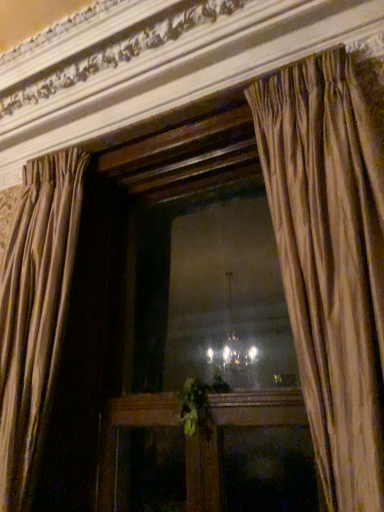
What do you see at coordinates (195, 406) in the screenshot? I see `green leafy plant at center` at bounding box center [195, 406].

What is the approximate height of silky beige curtain at center, which is the 2th curtain in left-to-right order?

silky beige curtain at center, which is the 2th curtain in left-to-right order, is 5.67 feet in height.

What do you see at coordinates (35, 314) in the screenshot?
I see `silky beige curtain at left, the second curtain from the right` at bounding box center [35, 314].

The image size is (384, 512). Find the location of `green leafy plant at center`. green leafy plant at center is located at coordinates (195, 406).

You are a GUI agent. You are given a task and a screenshot of the screen. Output one action in this format:
    pyautogui.click(x=<x>, y=<y>)
    Task: Click on the curtain above the silky beige curtain at left, the first curtain viewed from the left (from a real-world perspective)
    This screenshot has width=384, height=512.
    Given the screenshot: What is the action you would take?
    pyautogui.click(x=330, y=261)

Looking at this image, does silky beige curtain at center, which is the 2th curtain in left-to-right order, have a larger size compared to silky beige curtain at left, the first curtain viewed from the left?

No.

Does point (331, 424) come behind point (26, 322)?

No, (331, 424) is closer to viewer.

Are silky beige curtain at center, which is the 2th curtain in left-to-right order, and silky beige curtain at left, the first curtain viewed from the left, located far from each other?

Indeed, silky beige curtain at center, which is the 2th curtain in left-to-right order, is not near silky beige curtain at left, the first curtain viewed from the left.

Considering the relative sizes of silky beige curtain at left, the second curtain from the right, and silky beige curtain at center, the first curtain when ordered from right to left, in the image provided, is silky beige curtain at left, the second curtain from the right, wider than silky beige curtain at center, the first curtain when ordered from right to left,?

No, silky beige curtain at left, the second curtain from the right, is not wider than silky beige curtain at center, the first curtain when ordered from right to left.

From the image's perspective, is silky beige curtain at left, the first curtain viewed from the left, located above or below silky beige curtain at center, the first curtain when ordered from right to left?

Clearly, from the image's perspective, silky beige curtain at left, the first curtain viewed from the left, is below silky beige curtain at center, the first curtain when ordered from right to left.

What's the angular difference between silky beige curtain at left, the second curtain from the right, and silky beige curtain at center, the first curtain when ordered from right to left,'s facing directions?

The angular difference between silky beige curtain at left, the second curtain from the right, and silky beige curtain at center, the first curtain when ordered from right to left, is 9.12 degrees.

Based on the photo, is silky beige curtain at left, the first curtain viewed from the left, at the left side of silky beige curtain at center, the first curtain when ordered from right to left?

Yes, silky beige curtain at left, the first curtain viewed from the left, is to the left of silky beige curtain at center, the first curtain when ordered from right to left.

Between wooden frame at center and silky beige curtain at center, which is the 2th curtain in left-to-right order, which one has smaller size?

Smaller between the two is wooden frame at center.

Is wooden frame at center not near silky beige curtain at center, the first curtain when ordered from right to left?

They are positioned close to each other.

From the image's perspective, between wooden frame at center and silky beige curtain at center, which is the 2th curtain in left-to-right order, who is located below?

wooden frame at center appears lower in the image.

Considering the relative positions of wooden frame at center and silky beige curtain at center, the first curtain when ordered from right to left, in the image provided, is wooden frame at center to the left of silky beige curtain at center, the first curtain when ordered from right to left, from the viewer's perspective?

Yes.

Would you say green leafy plant at center is a long distance from silky beige curtain at center, which is the 2th curtain in left-to-right order?

No, green leafy plant at center is not far away from silky beige curtain at center, which is the 2th curtain in left-to-right order.

Locate an element on the screen. The height and width of the screenshot is (512, 384). the 2nd curtain located above the green leafy plant at center (from a real-world perspective) is located at coordinates (330, 261).

Which object is positioned more to the left, green leafy plant at center or silky beige curtain at center, the first curtain when ordered from right to left?

From the viewer's perspective, green leafy plant at center appears more on the left side.

Between green leafy plant at center and silky beige curtain at center, the first curtain when ordered from right to left, which one has smaller width?

green leafy plant at center.

In the image, there is a green leafy plant at center. What are the coordinates of `furniture below it (from the image's perspective)` in the screenshot? It's located at coord(222,438).

In terms of height, does wooden frame at center look taller or shorter compared to green leafy plant at center?

wooden frame at center is taller than green leafy plant at center.

From a real-world perspective, is wooden frame at center on green leafy plant at center?

Incorrect, from a real-world perspective, wooden frame at center is lower than green leafy plant at center.

From the image's perspective, is wooden frame at center located above green leafy plant at center?

No, from the image's perspective, wooden frame at center is not on top of green leafy plant at center.

Can we say green leafy plant at center lies outside silky beige curtain at left, the first curtain viewed from the left?

Yes, green leafy plant at center is located beyond the bounds of silky beige curtain at left, the first curtain viewed from the left.

Which of these two, green leafy plant at center or silky beige curtain at left, the first curtain viewed from the left, is smaller?

Smaller between the two is green leafy plant at center.

How different are the orientations of green leafy plant at center and silky beige curtain at left, the second curtain from the right, in degrees?

The facing directions of green leafy plant at center and silky beige curtain at left, the second curtain from the right, are 2.35 degrees apart.

From a real-world perspective, is green leafy plant at center located beneath silky beige curtain at left, the first curtain viewed from the left?

Yes, from a real-world perspective, green leafy plant at center is under silky beige curtain at left, the first curtain viewed from the left.

Does silky beige curtain at left, the second curtain from the right, have a greater height compared to green leafy plant at center?

Indeed, silky beige curtain at left, the second curtain from the right, has a greater height compared to green leafy plant at center.

In the scene shown: Are silky beige curtain at left, the first curtain viewed from the left, and green leafy plant at center far apart?

No, there isn't a large distance between silky beige curtain at left, the first curtain viewed from the left, and green leafy plant at center.

Which is more to the left, silky beige curtain at left, the first curtain viewed from the left, or green leafy plant at center?

silky beige curtain at left, the first curtain viewed from the left.

Locate an element on the screen. The width and height of the screenshot is (384, 512). curtain below the silky beige curtain at center, the first curtain when ordered from right to left (from the image's perspective) is located at coordinates (35, 314).

Image resolution: width=384 pixels, height=512 pixels. Identify the location of curtain located above the silky beige curtain at left, the first curtain viewed from the left (from the image's perspective). (330, 261).

From the image, which object appears to be farther from green leafy plant at center, silky beige curtain at center, the first curtain when ordered from right to left, or silky beige curtain at left, the first curtain viewed from the left?

silky beige curtain at center, the first curtain when ordered from right to left, is further to green leafy plant at center.

Which object lies nearer to the anchor point silky beige curtain at left, the second curtain from the right, green leafy plant at center or wooden frame at center?

wooden frame at center.

Estimate the real-world distances between objects in this image. Which object is further from wooden frame at center, green leafy plant at center or silky beige curtain at left, the first curtain viewed from the left?

silky beige curtain at left, the first curtain viewed from the left, is positioned further to the anchor wooden frame at center.

Considering their positions, is silky beige curtain at left, the first curtain viewed from the left, positioned further to silky beige curtain at center, the first curtain when ordered from right to left, than green leafy plant at center?

The object further to silky beige curtain at center, the first curtain when ordered from right to left, is silky beige curtain at left, the first curtain viewed from the left.

When comparing their distances from silky beige curtain at center, which is the 2th curtain in left-to-right order, does green leafy plant at center or wooden frame at center seem further?

green leafy plant at center lies further to silky beige curtain at center, which is the 2th curtain in left-to-right order, than the other object.

Looking at the image, which one is located further to wooden frame at center, silky beige curtain at center, which is the 2th curtain in left-to-right order, or green leafy plant at center?

Based on the image, silky beige curtain at center, which is the 2th curtain in left-to-right order, appears to be further to wooden frame at center.

Looking at the image, which one is located further to wooden frame at center, silky beige curtain at left, the second curtain from the right, or green leafy plant at center?

silky beige curtain at left, the second curtain from the right.

Based on their spatial positions, is silky beige curtain at center, which is the 2th curtain in left-to-right order, or wooden frame at center further from silky beige curtain at left, the first curtain viewed from the left?

silky beige curtain at center, which is the 2th curtain in left-to-right order, lies further to silky beige curtain at left, the first curtain viewed from the left, than the other object.

Locate an element on the screen. plant between silky beige curtain at center, which is the 2th curtain in left-to-right order, and wooden frame at center vertically is located at coordinates pyautogui.click(x=195, y=406).

In order to click on furniture located between silky beige curtain at left, the second curtain from the right, and silky beige curtain at center, which is the 2th curtain in left-to-right order, in the left-right direction in this screenshot , I will do `click(222, 438)`.

You are a GUI agent. You are given a task and a screenshot of the screen. Output one action in this format:
    pyautogui.click(x=<x>, y=<y>)
    Task: Click on the plant located between silky beige curtain at left, the second curtain from the right, and wooden frame at center in the left-right direction
    This screenshot has width=384, height=512.
    Given the screenshot: What is the action you would take?
    pyautogui.click(x=195, y=406)

The width and height of the screenshot is (384, 512). Identify the location of plant between silky beige curtain at left, the first curtain viewed from the left, and silky beige curtain at center, the first curtain when ordered from right to left. (195, 406).